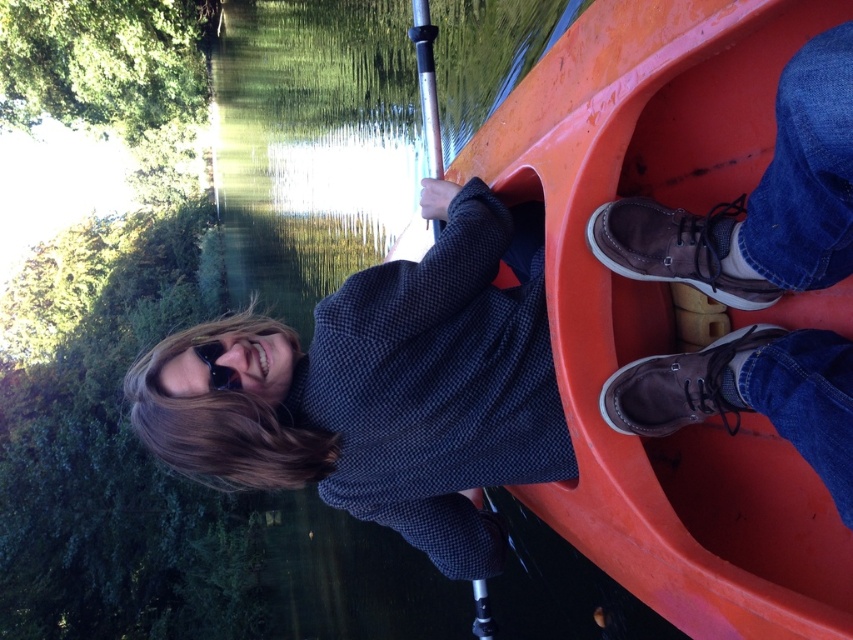
Question: Which point appears closest to the camera in this image?

Choices:
 (A) (697, 397)
 (B) (613, 296)
 (C) (457, 413)
 (D) (489, 636)

Answer: (A)

Question: Which point appears farthest from the camera in this image?

Choices:
 (A) (428, 172)
 (B) (762, 595)
 (C) (840, 243)
 (D) (303, 442)

Answer: (A)

Question: Can you confirm if dark blue sweater at center is positioned to the left of brown suede shoes at lower right?

Choices:
 (A) yes
 (B) no

Answer: (A)

Question: Is dark blue sweater at center thinner than brown suede shoes at lower right?

Choices:
 (A) no
 (B) yes

Answer: (A)

Question: Can you confirm if dark blue sweater at center is smaller than silver metallic paddle at center?

Choices:
 (A) no
 (B) yes

Answer: (A)

Question: Which object appears farthest from the camera in this image?

Choices:
 (A) dark blue sweater at center
 (B) brown suede shoes at lower right
 (C) orange matte plastic boat at center

Answer: (A)